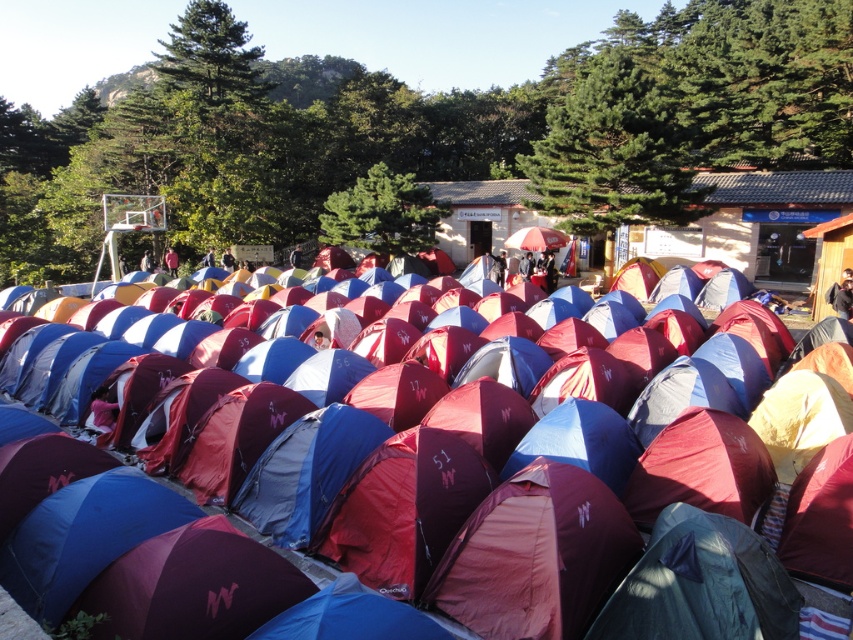
You are a participant at the event and want to set up your equipment under the red fabric umbrella at center. However, there is a blue fabric tent at center in the way. Can you place your equipment directly under the umbrella without moving the tent?

The blue fabric tent at center is located below the red fabric umbrella at center, so the tent is directly under the umbrella. This means you cannot place your equipment directly under the umbrella without moving the tent because the tent is already occupying that space.